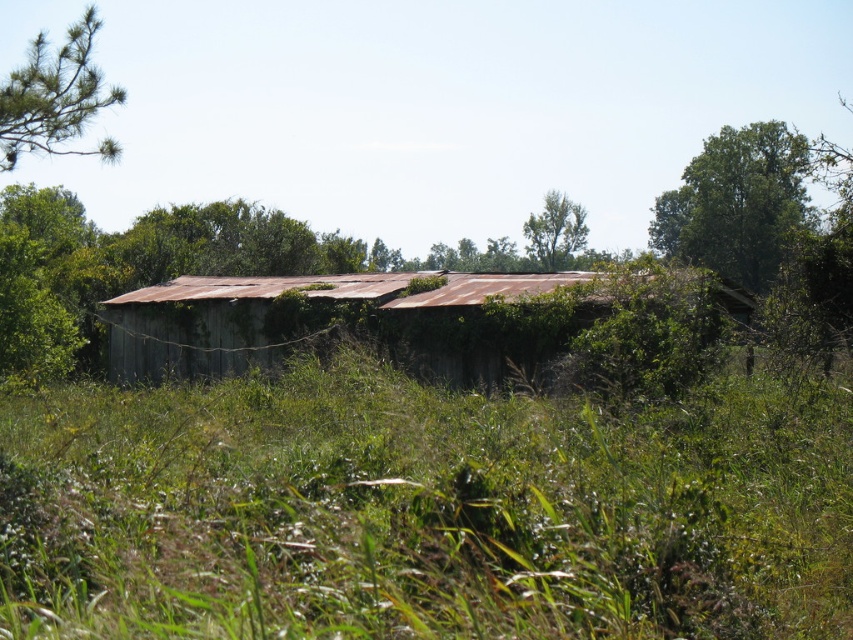
In the scene shown: You are standing in front of the old shed and notice two trees in the distance. Which tree, the green matte tree at upper left or the green leafy tree at upper center, is positioned higher up in the image?

The green matte tree at upper left is positioned higher up in the image than the green leafy tree at upper center.

You are standing in front of an old shed surrounded by tall grass. You notice two points marked on the ground. The first point is at coordinate point [57,140], and the second is at point [550,198]. Which point is closer to you?

Point [57,140] is in front of point [550,198], so the first point is closer to you.